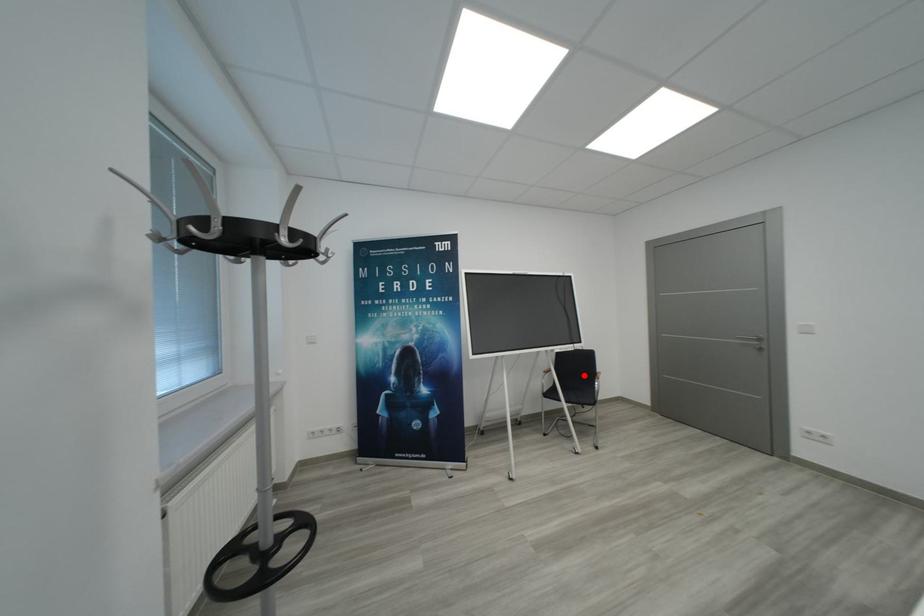
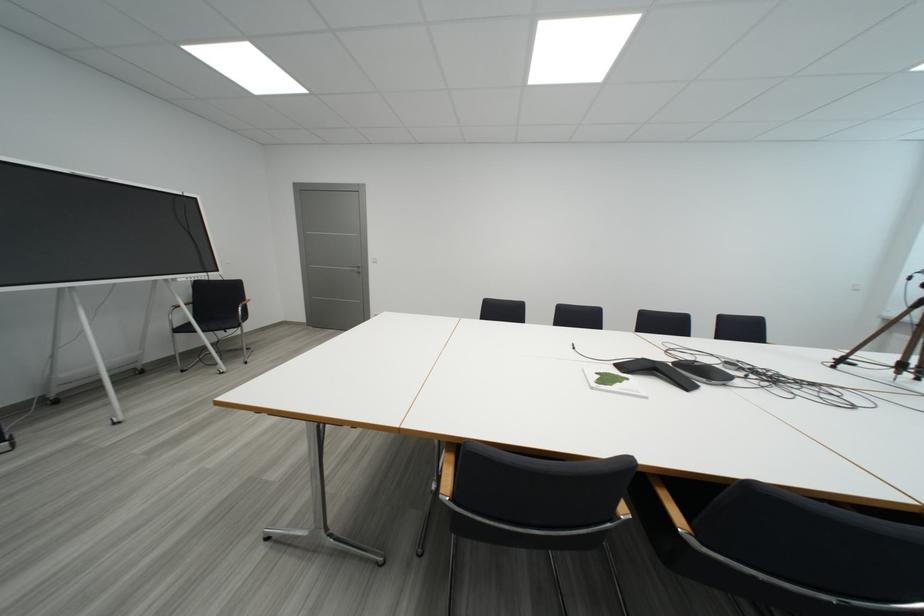
Question: I am providing you with two images of the same scene from different viewpoints. Given a red point in image1, look at the same physical point in image2. Is it:

Choices:
 (A) Closer to the viewpoint
 (B) Farther from the viewpoint

Answer: (A)